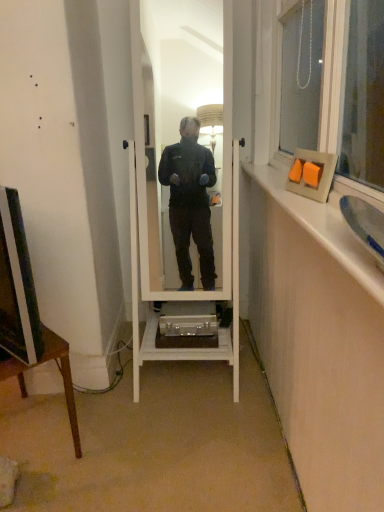
What are the coordinates of `vacant space underneath white wooden mirror at center (from a real-world perspective)` in the screenshot? It's located at (194, 380).